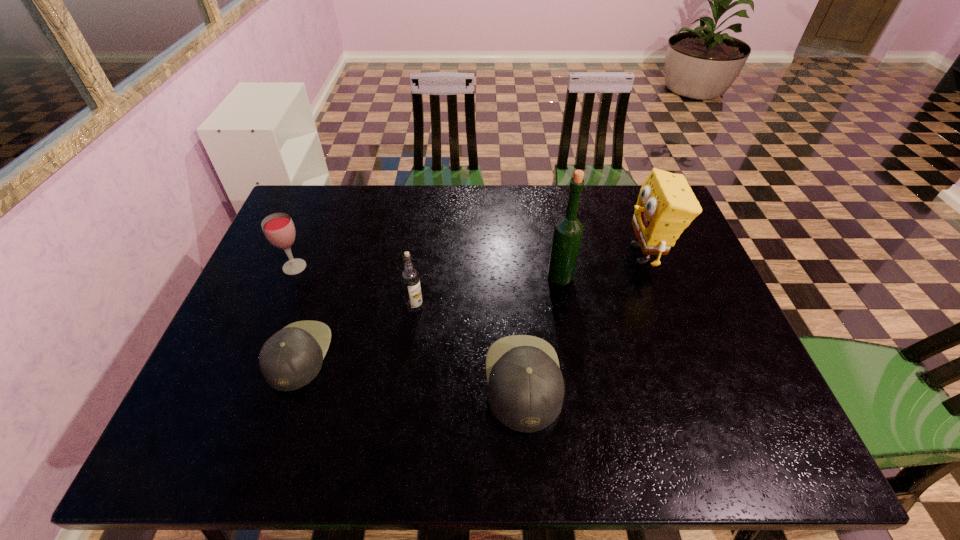
You are a GUI agent. You are given a task and a screenshot of the screen. Output one action in this format:
    pyautogui.click(x=<x>, y=<y>)
    Task: Click on the free space between the sponge and the third object from right to left
    This screenshot has width=960, height=540.
    Given the screenshot: What is the action you would take?
    pyautogui.click(x=584, y=318)

Locate an element on the screen. Image resolution: width=960 pixels, height=540 pixels. free spot between the tallest object and the wineglass is located at coordinates (427, 272).

The image size is (960, 540). Identify the location of vacant space that's between the second object from right to left and the taller cap. (541, 329).

Image resolution: width=960 pixels, height=540 pixels. I want to click on unoccupied position between the tallest object and the second shortest object, so click(541, 329).

Where is `vacant space that is in between the wineglass and the rightmost object`? This screenshot has height=540, width=960. vacant space that is in between the wineglass and the rightmost object is located at coordinates (469, 261).

Where is `vacant area that lies between the tallest object and the shorter cap`? vacant area that lies between the tallest object and the shorter cap is located at coordinates (429, 316).

The width and height of the screenshot is (960, 540). Identify the location of free point between the second object from right to left and the wineglass. (427, 272).

Identify the location of free space between the vodka and the second tallest object. (530, 281).

Find the location of a particular element. The image size is (960, 540). vacant space in between the right cap and the fifth shortest object is located at coordinates pyautogui.click(x=584, y=318).

Locate which object ranks fifth in proximity to the tallest object. Please provide its 2D coordinates. Your answer should be formatted as a tuple, i.e. [(x, y)], where the tuple contains the x and y coordinates of a point satisfying the conditions above.

[(278, 228)]